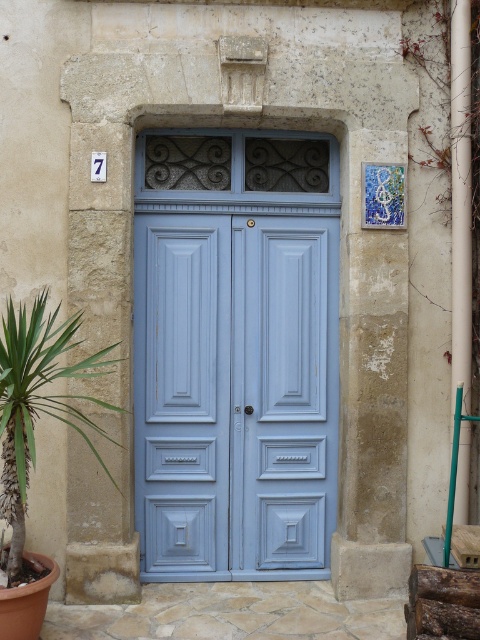
Consider the image. You are standing in front of the entrance and want to touch both the light blue wood door at center and the green leafy plant at lower left. Which object will you reach first?

You will reach the light blue wood door at center first because it is closer to you than the green leafy plant at lower left, which is further away.

You are standing in front of the entrance and need to locate the green leafy plant at lower left. Based on the scene, where should you look relative to the light blue wood door at center?

The green leafy plant at lower left is to the left of the light blue wood door at center.

You are a delivery person standing at the entrance of the building. You need to place a package on the ground near the light blue wood door at center. However, there is a green leafy plant at lower left nearby. Can you place the package between the two objects without it touching either?

The light blue wood door at center is 36.02 inches away from the green leafy plant at lower left. Since the package requires some space, there is enough room to place it between them without touching either object.